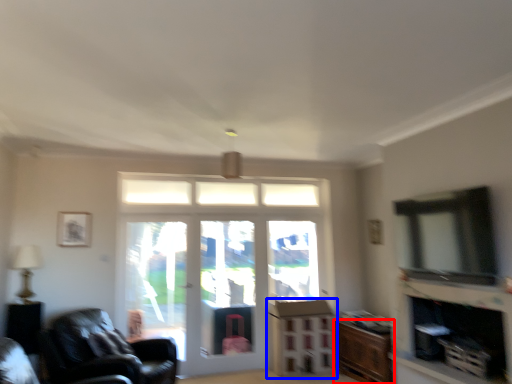
Question: Which of the following is the closest to the observer, cabinetry (highlighted by a red box) or dresser (highlighted by a blue box)?

Choices:
 (A) cabinetry
 (B) dresser

Answer: (A)